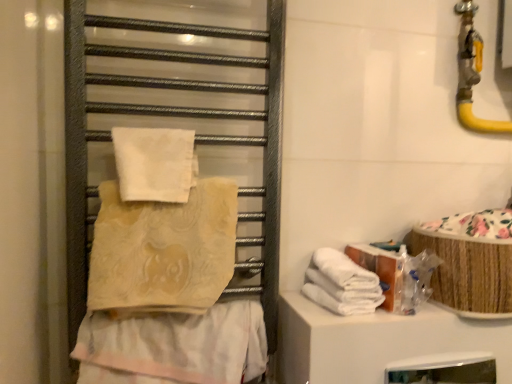
Question: Is metallic towel rack at left a part of white soft towel at upper center, which is the first towel in top-to-bottom order?

Choices:
 (A) yes
 (B) no

Answer: (B)

Question: From the image's perspective, would you say white soft towel at upper center, which is the first towel in top-to-bottom order, is shown under metallic towel rack at left?

Choices:
 (A) no
 (B) yes

Answer: (A)

Question: Is white soft towel at upper center, marked as the 4th towel in a bottom-to-top arrangement, smaller than metallic towel rack at left?

Choices:
 (A) yes
 (B) no

Answer: (A)

Question: Can you confirm if white soft towel at upper center, marked as the 4th towel in a bottom-to-top arrangement, is wider than metallic towel rack at left?

Choices:
 (A) no
 (B) yes

Answer: (A)

Question: Is white soft towel at upper center, which is the first towel in top-to-bottom order, not within metallic towel rack at left?

Choices:
 (A) yes
 (B) no

Answer: (B)

Question: Considering the positions of point (123, 168) and point (186, 314), is point (123, 168) closer or farther from the camera than point (186, 314)?

Choices:
 (A) closer
 (B) farther

Answer: (A)

Question: From their relative heights in the image, would you say white soft towel at upper center, which is the first towel in top-to-bottom order, is taller or shorter than beige textured towel at center, arranged as the 1th towel when ordered from the bottom?

Choices:
 (A) short
 (B) tall

Answer: (A)

Question: From the image's perspective, is white soft towel at upper center, marked as the 4th towel in a bottom-to-top arrangement, located above or below beige textured towel at center, arranged as the 1th towel when ordered from the bottom?

Choices:
 (A) above
 (B) below

Answer: (A)

Question: From a real-world perspective, is white soft towel at upper center, which is the first towel in top-to-bottom order, physically located above or below beige textured towel at center, the fourth towel positioned from the top?

Choices:
 (A) above
 (B) below

Answer: (A)

Question: From their relative heights in the image, would you say beige textured towel at center, positioned as the second towel in top-to-bottom order, is taller or shorter than white soft towel at upper center, marked as the 4th towel in a bottom-to-top arrangement?

Choices:
 (A) tall
 (B) short

Answer: (A)

Question: Is beige textured towel at center, the third towel when ordered from bottom to top, spatially inside white soft towel at upper center, marked as the 4th towel in a bottom-to-top arrangement, or outside of it?

Choices:
 (A) inside
 (B) outside

Answer: (B)

Question: Is point (146, 288) closer or farther from the camera than point (117, 157)?

Choices:
 (A) closer
 (B) farther

Answer: (B)

Question: Looking at their shapes, would you say beige textured towel at center, the third towel when ordered from bottom to top, is wider or thinner than white soft towel at upper center, marked as the 4th towel in a bottom-to-top arrangement?

Choices:
 (A) thin
 (B) wide

Answer: (B)

Question: In the image, is metallic towel rack at left positioned in front of or behind beige textured towel at center, the fourth towel positioned from the top?

Choices:
 (A) front
 (B) behind

Answer: (A)

Question: Considering the positions of metallic towel rack at left and beige textured towel at center, arranged as the 1th towel when ordered from the bottom, in the image, is metallic towel rack at left taller or shorter than beige textured towel at center, arranged as the 1th towel when ordered from the bottom,?

Choices:
 (A) tall
 (B) short

Answer: (A)